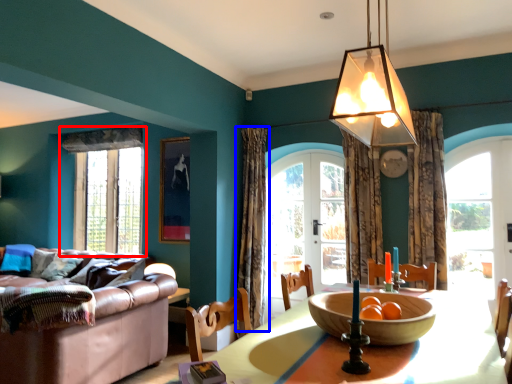
Question: Which of the following is the closest to the observer, window (highlighted by a red box) or curtain (highlighted by a blue box)?

Choices:
 (A) window
 (B) curtain

Answer: (B)